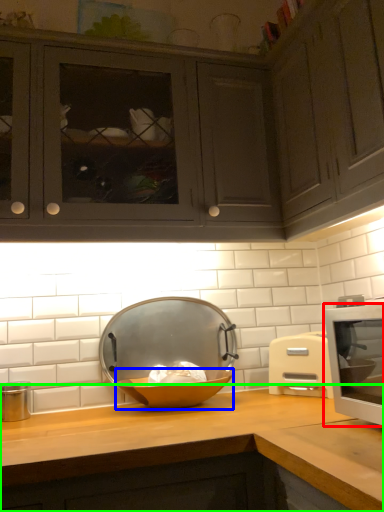
Question: Considering the real-world distances, which object is closest to home appliance (highlighted by a red box)? bowl (highlighted by a blue box) or countertop (highlighted by a green box).

Choices:
 (A) bowl
 (B) countertop

Answer: (B)